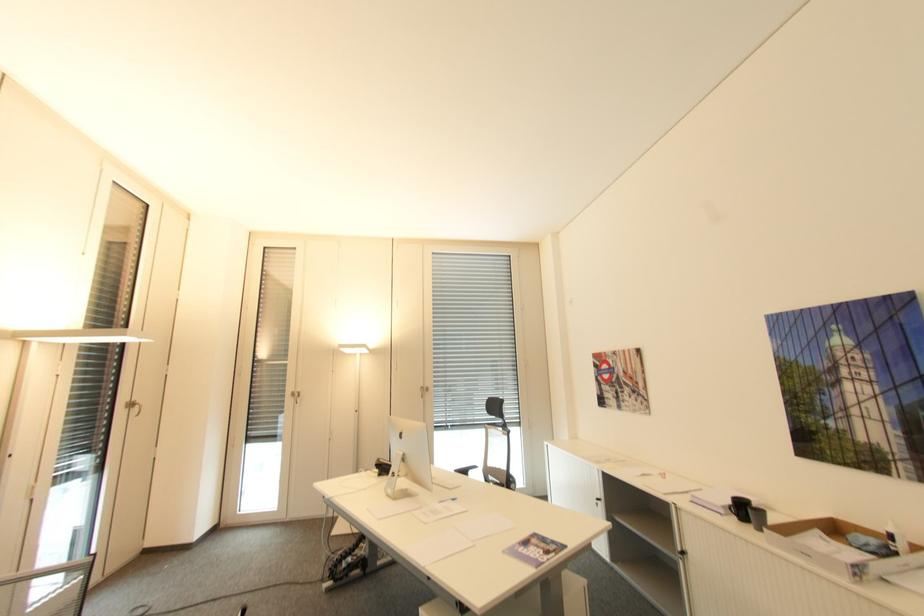
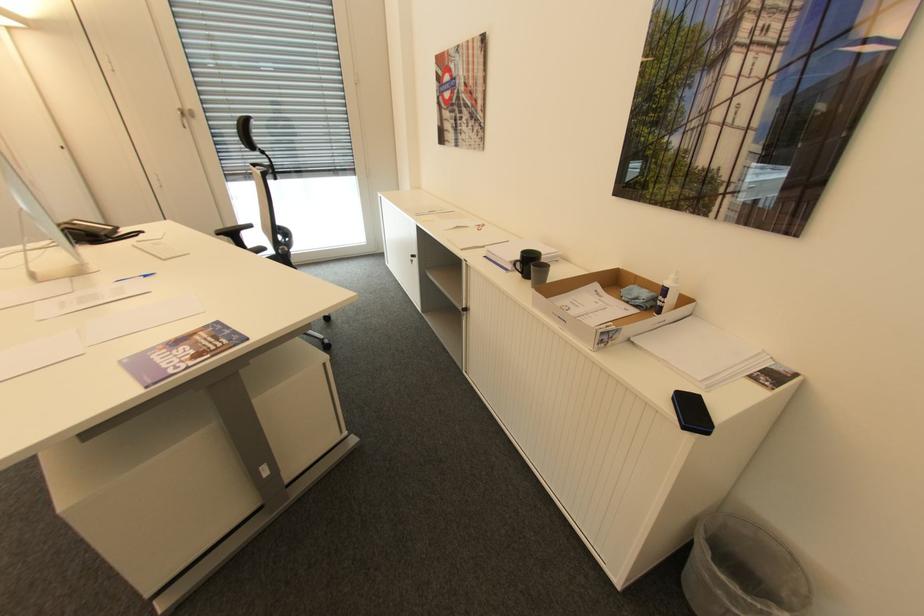
In the second image, find the point that corresponds to (602,500) in the first image.

(418, 256)